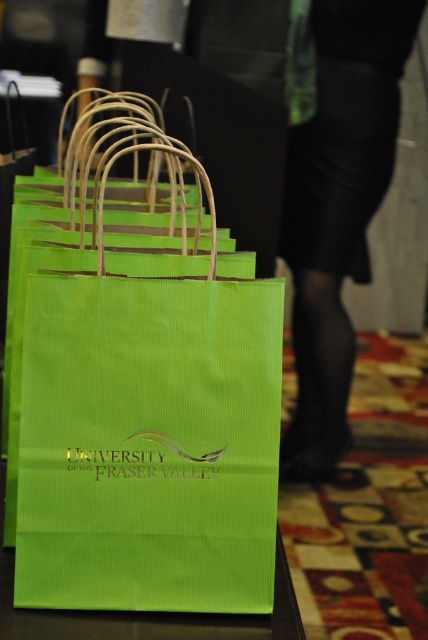
Question: Which point is farther from the camera taking this photo?

Choices:
 (A) (324, 214)
 (B) (122, 545)

Answer: (A)

Question: Is green paper bag at center wider than matte green paper bag at lower left?

Choices:
 (A) yes
 (B) no

Answer: (B)

Question: Which point is closer to the camera?

Choices:
 (A) matte green paper bag at lower left
 (B) green paper bag at center

Answer: (B)

Question: Is green paper bag at center in front of matte green paper bag at lower left?

Choices:
 (A) yes
 (B) no

Answer: (A)

Question: Can you confirm if green paper bag at center is positioned above matte green paper bag at lower left?

Choices:
 (A) no
 (B) yes

Answer: (A)